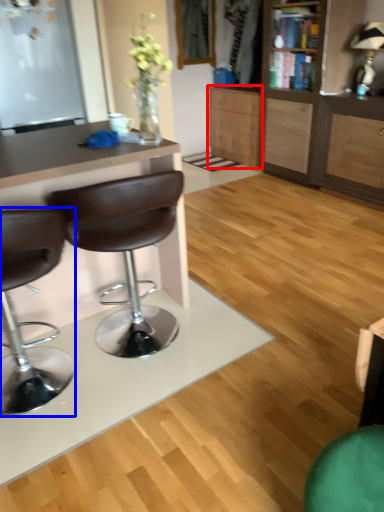
Question: Which object appears closest to the camera in this image, cabinetry (highlighted by a red box) or chair (highlighted by a blue box)?

Choices:
 (A) cabinetry
 (B) chair

Answer: (B)